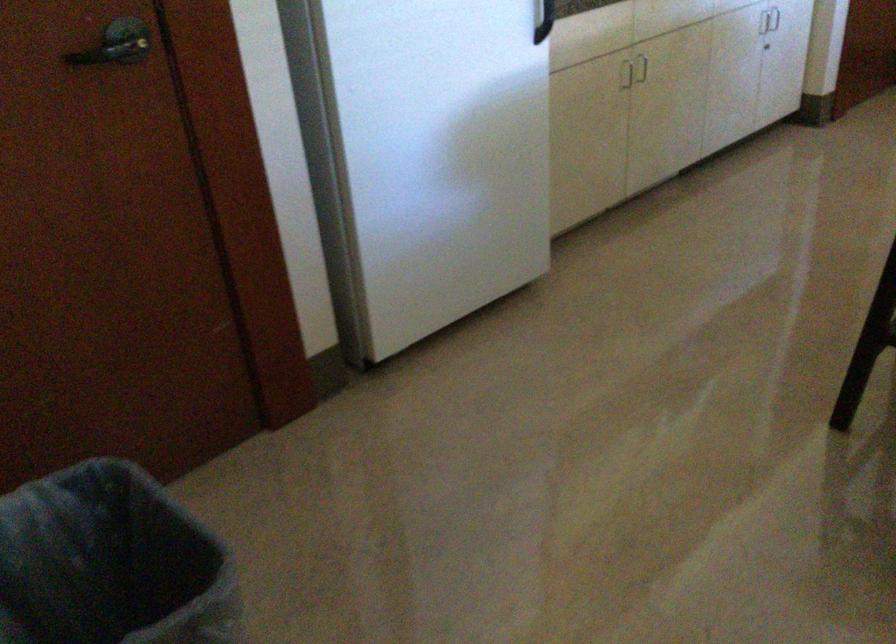
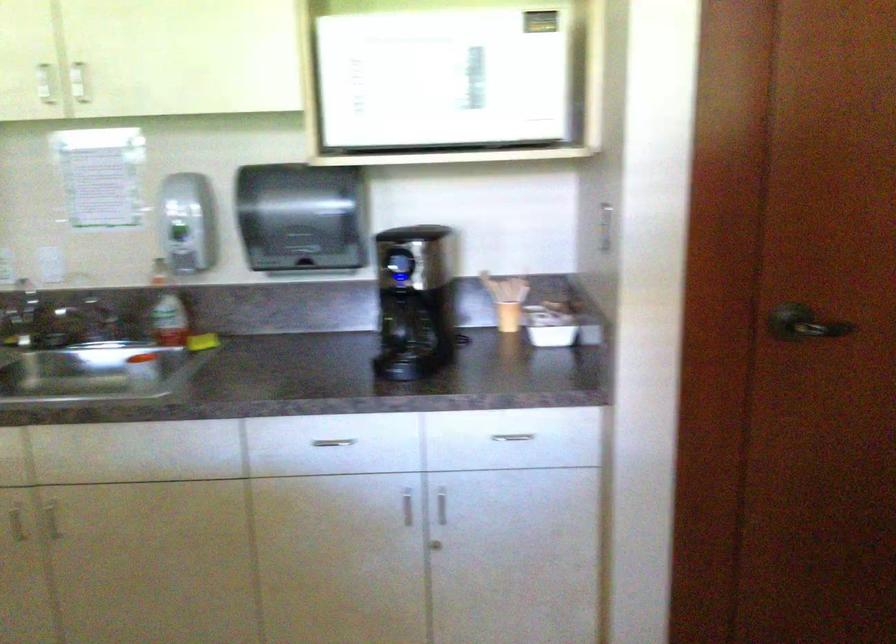
Locate, in the second image, the point that corresponds to (x=652, y=79) in the first image.

(52, 520)